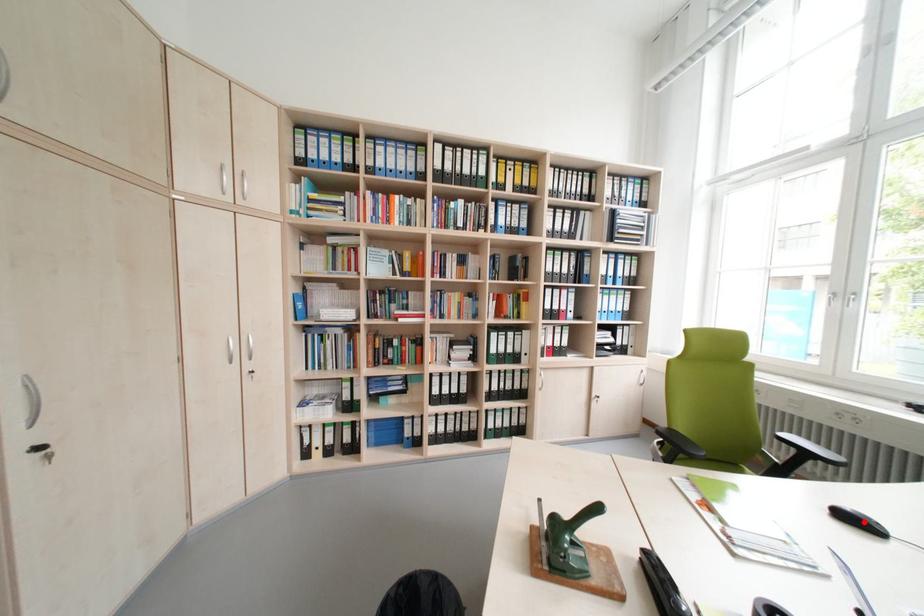
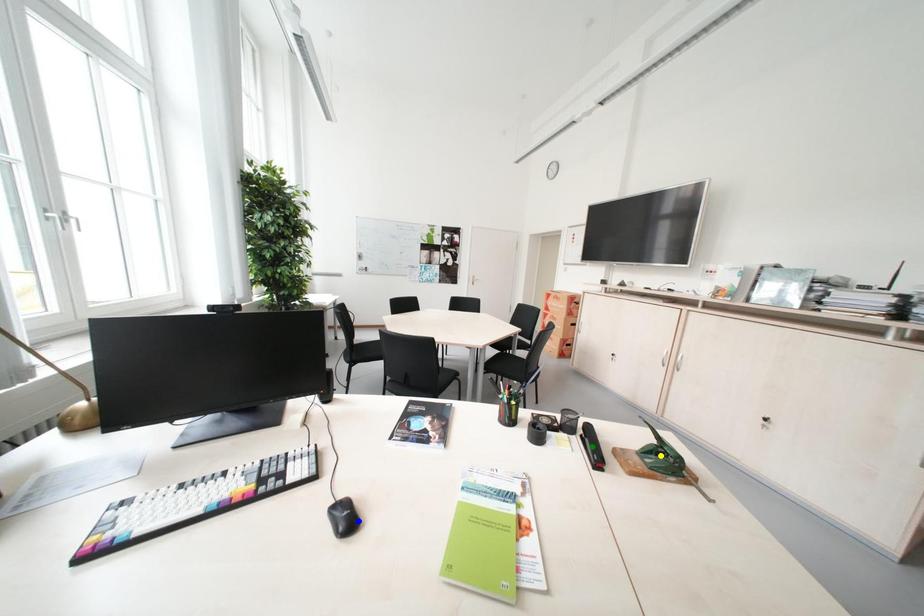
Question: I am providing you with two images of the same scene from different viewpoints. A red point is marked on the first image. You are given multiple points on the second image. Which point in image 2 represents the same 3d spot as the red point in image 1?

Choices:
 (A) blue point
 (B) yellow point
 (C) green point

Answer: (A)